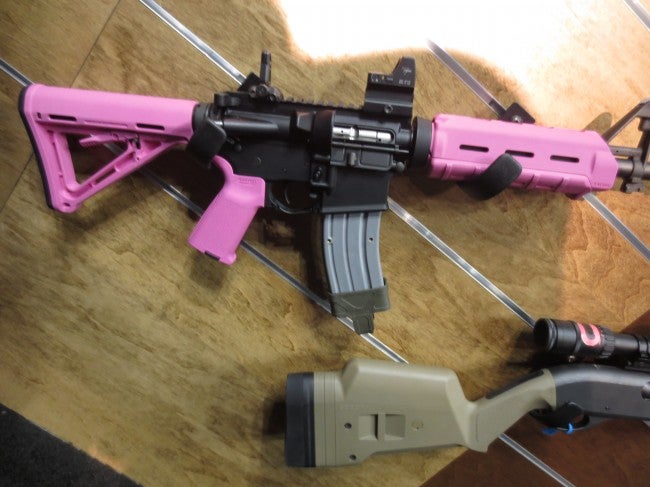
The height and width of the screenshot is (487, 650). Find the location of `wall`. wall is located at coordinates (108, 337).